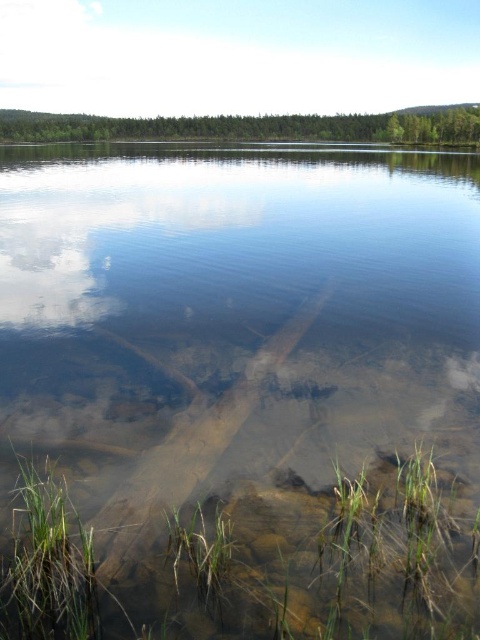
You are standing at the center of the image and want to walk towards the green grassy at lower left. Which direction should you face to head directly towards it?

To head directly towards the green grassy at lower left, you should face the lower left direction since it is located at point 0.880 on the x axis and 0.533 on the y axis, which is in the lower left quadrant of the image.

You are standing at the lakeside and see the green grassy at lower left and the white fluffy cloud at upper center. Which object appears smaller in the image?

The green grassy at lower left appears smaller than the white fluffy cloud at upper center in the image.

You are standing at the lakeside and want to take a photo that includes both the green grassy at lower left and the white fluffy cloud at upper center. Considering their distance apart, will they both fit in the frame of a standard smartphone camera?

The green grassy at lower left and the white fluffy cloud at upper center are 527.39 meters apart. A standard smartphone camera has a limited field of view, so capturing both objects at such a great distance might not be possible unless you use a wide angle lens or move closer to them.